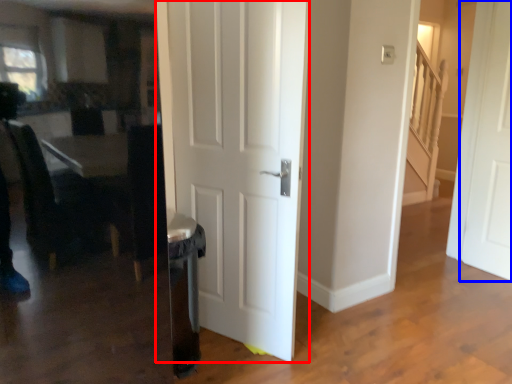
Question: Among these objects, which one is nearest to the camera, door (highlighted by a red box) or door (highlighted by a blue box)?

Choices:
 (A) door
 (B) door

Answer: (A)